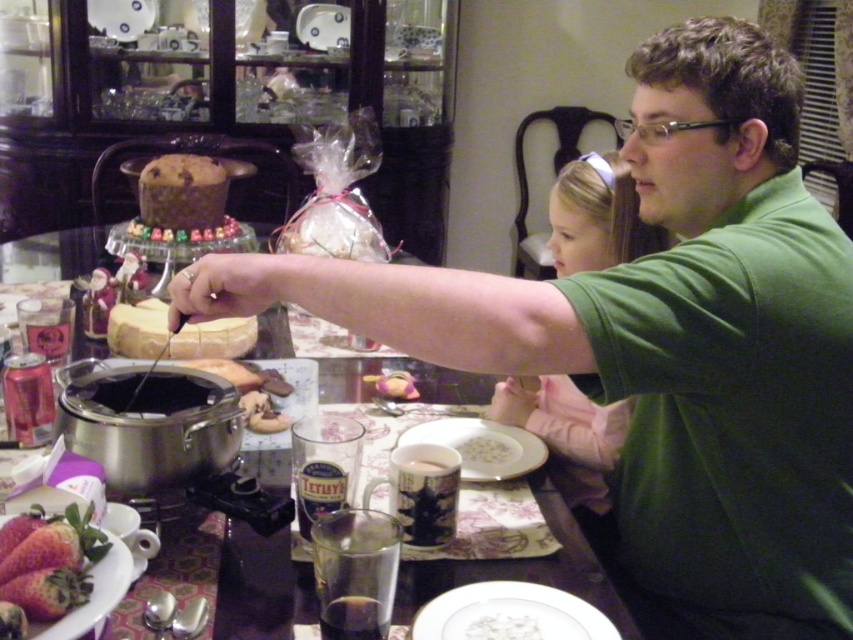
You are a guest at the dining table and want to reach for the white ceramic mug at center. Considering your arm can extend 0.9 meters, can you comfortably reach it without moving your chair?

The white ceramic mug at center is 1.02 meters away from the viewer. Since your arm can only extend 0.9 meters, you cannot comfortably reach it without moving your chair.